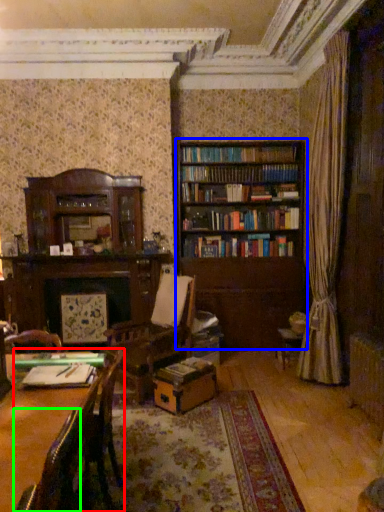
Question: Considering the real-world distances, which object is farthest from chair (highlighted by a red box)? bookcase (highlighted by a blue box) or chair (highlighted by a green box)?

Choices:
 (A) bookcase
 (B) chair

Answer: (A)